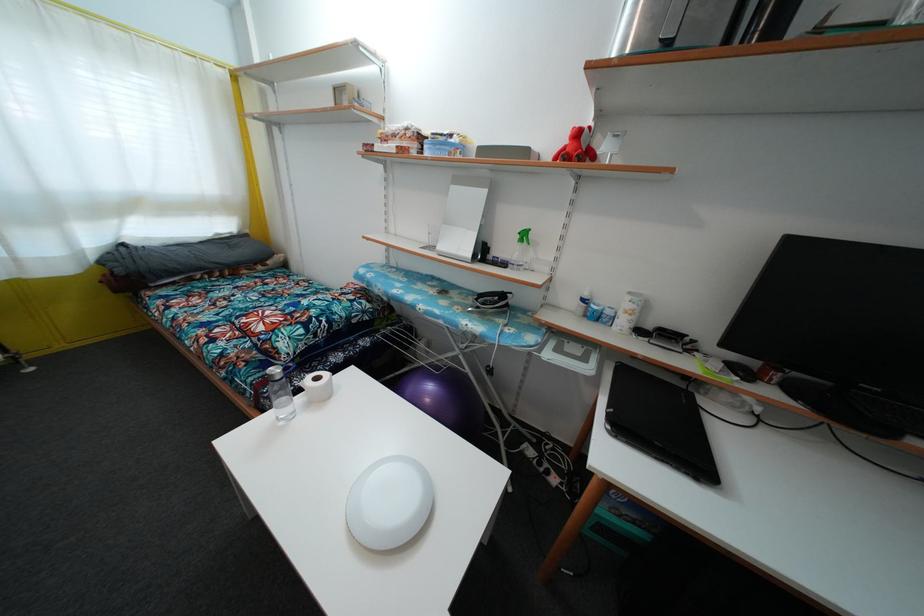
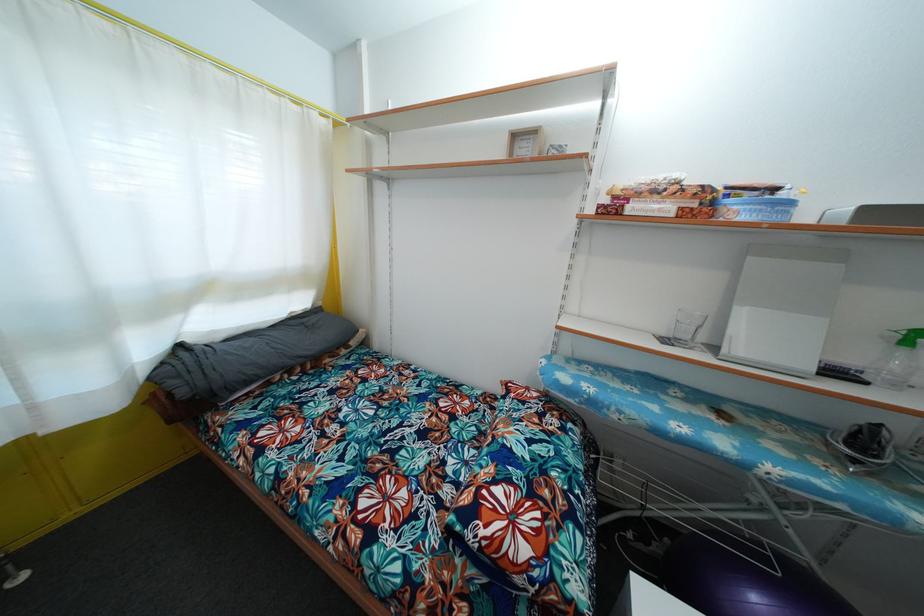
The images are taken continuously from a first-person perspective. In which direction are you moving?

The cameraman moved toward left, forward.